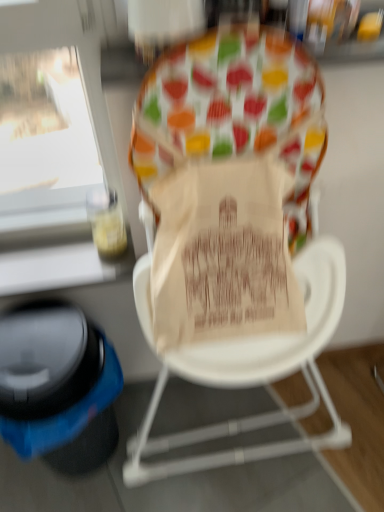
Identify the location of beige fabric chair at center. [x=233, y=236].

What do you see at coordinates (233, 236) in the screenshot? I see `beige fabric chair at center` at bounding box center [233, 236].

Identify the location of beige fabric chair at center. The width and height of the screenshot is (384, 512). (233, 236).